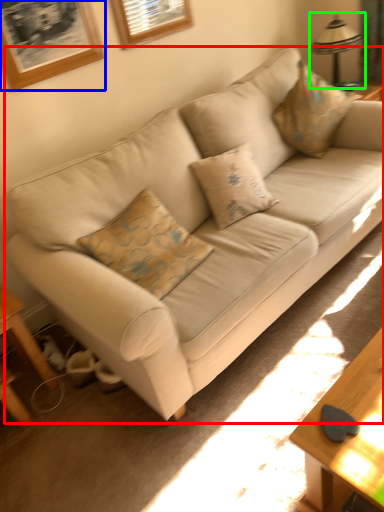
Question: Estimate the real-world distances between objects in this image. Which object is farther from studio couch (highlighted by a red box), picture frame (highlighted by a blue box) or table lamp (highlighted by a green box)?

Choices:
 (A) picture frame
 (B) table lamp

Answer: (B)